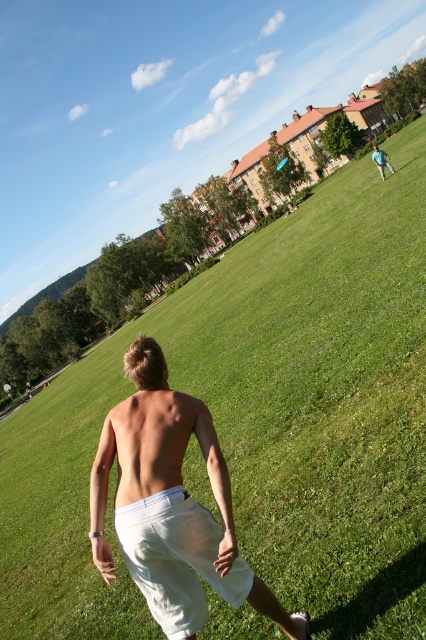
You are a photographer trying to capture the person running in the scene. You want to focus on the white cotton shorts at lower center and the skinny white shorts at center. Which of these two shorts is positioned lower in the image?

The white cotton shorts at lower center is positioned lower in the image than the skinny white shorts at center.

You are a fashion designer observing the image and want to create a design that accommodates both the white cotton shorts at lower center and the skinny white shorts at center. Which pair of shorts would require a wider fabric width in the leg area for proper fitting?

The white cotton shorts at lower center require a wider fabric width in the leg area because their width surpasses that of the skinny white shorts at center.